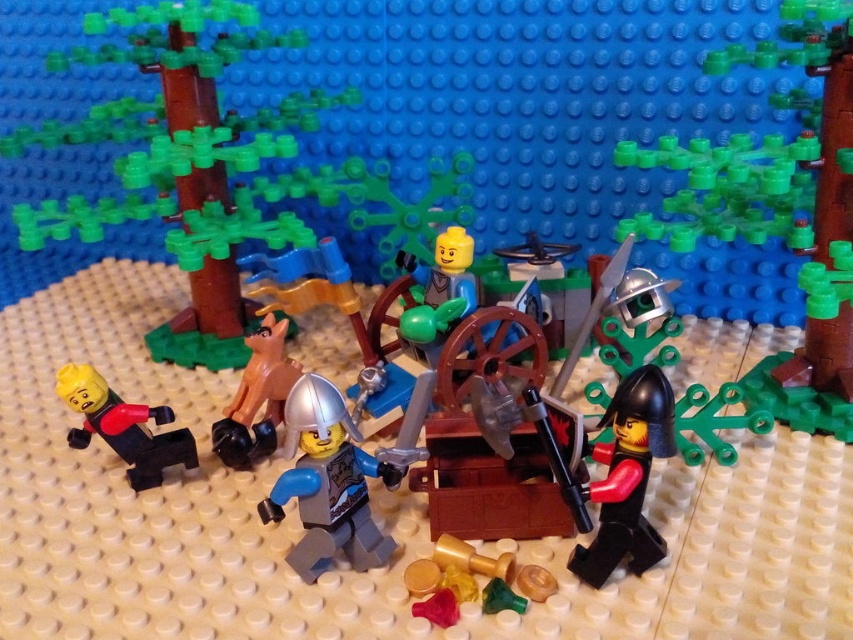
Who is positioned more to the right, light blue plastic minifigure at center or matte black helmet at lower right?

matte black helmet at lower right

Is point (310, 412) closer to viewer compared to point (611, 445)?

Yes, point (310, 412) is closer to viewer.

Where is `light blue plastic minifigure at center`? This screenshot has width=853, height=640. light blue plastic minifigure at center is located at coordinates (328, 483).

Identify the location of light blue plastic minifigure at center. (328, 483).

Is point (109, 412) positioned before point (252, 376)?

Yes, it is in front of point (252, 376).

Is matte black minifigure at left to the left of brown matte animal at center from the viewer's perspective?

Yes, matte black minifigure at left is to the left of brown matte animal at center.

Which is in front, point (138, 458) or point (277, 353)?

Point (138, 458) is in front.

Image resolution: width=853 pixels, height=640 pixels. What are the coordinates of `matte black minifigure at left` in the screenshot? It's located at (123, 426).

Can you confirm if brown wood tree at left is positioned to the right of brown matte animal at center?

In fact, brown wood tree at left is to the left of brown matte animal at center.

Is brown wood tree at left wider than brown matte animal at center?

Yes, brown wood tree at left is wider than brown matte animal at center.

Is point (173, 189) positioned after point (268, 440)?

That is True.

You are a GUI agent. You are given a task and a screenshot of the screen. Output one action in this format:
    pyautogui.click(x=<x>, y=<y>)
    Task: Click on the brown wood tree at left
    
    Given the screenshot: What is the action you would take?
    pyautogui.click(x=181, y=157)